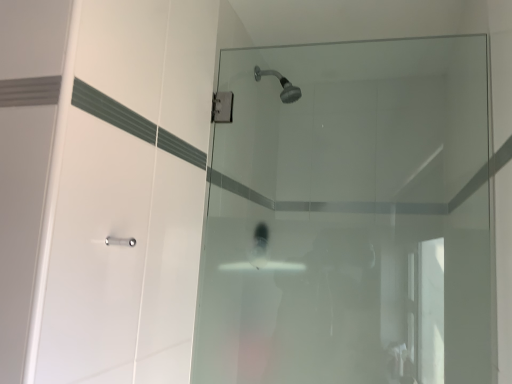
Locate an element on the screen. transparent glass shower door at center is located at coordinates (349, 217).

In order to face transparent glass shower door at center, should I rotate leftwards or rightwards?

Turn right approximately 11.025 degrees to face it.

This screenshot has height=384, width=512. What do you see at coordinates (349, 217) in the screenshot?
I see `transparent glass shower door at center` at bounding box center [349, 217].

Locate an element on the screen. transparent glass shower door at center is located at coordinates pyautogui.click(x=349, y=217).